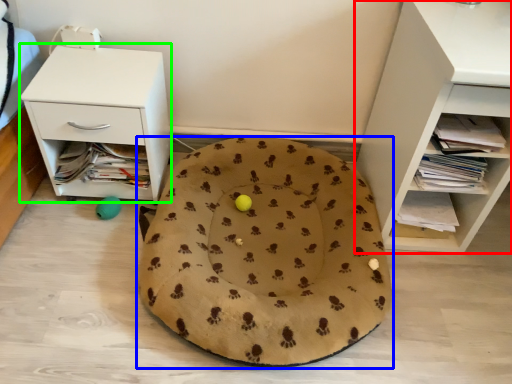
Question: Which object is the closest to the shelf (highlighted by a red box)? Choose among these: dog bed (highlighted by a blue box) or nightstand (highlighted by a green box).

Choices:
 (A) dog bed
 (B) nightstand

Answer: (A)